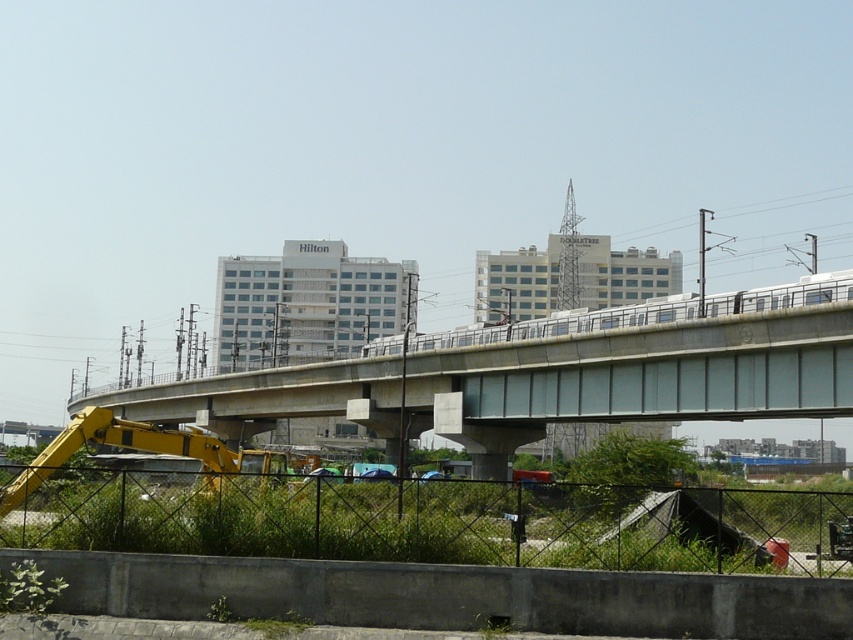
Is concrete at center further to the viewer compared to silver metallic train at center?

No.

Which is below, concrete at center or silver metallic train at center?

concrete at center

This screenshot has height=640, width=853. In order to click on concrete at center in this screenshot , I will do `click(637, 376)`.